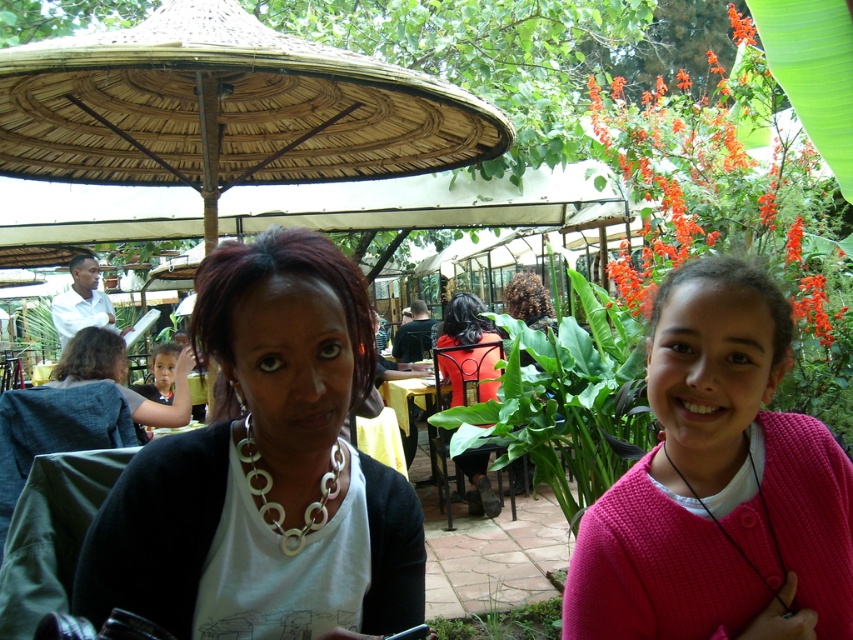
Does pink knitted sweater at center have a larger size compared to yellow fabric table at center?

No, pink knitted sweater at center is not bigger than yellow fabric table at center.

Is pink knitted sweater at center shorter than yellow fabric table at center?

Yes, pink knitted sweater at center is shorter than yellow fabric table at center.

Looking at this image, who is more distant from viewer, (x=625, y=502) or (x=384, y=403)?

The point (x=384, y=403) is behind.

In order to click on pink knitted sweater at center in this screenshot , I will do `click(718, 484)`.

Which is behind, point (485, 512) or point (403, 388)?

The point (403, 388) is more distant.

Measure the distance between orange fabric chair at center and camera.

The distance of orange fabric chair at center from camera is 4.81 meters.

Does point (486, 340) come closer to viewer compared to point (409, 365)?

Yes.

This screenshot has height=640, width=853. What are the coordinates of `orange fabric chair at center` in the screenshot? It's located at (468, 349).

Who is taller, matte white necklace at center or silver metallic necklace at center?

matte white necklace at center

Is point (361, 368) positioned after point (311, 500)?

That is False.

Identify the location of matte white necklace at center. (288, 349).

You are a GUI agent. You are given a task and a screenshot of the screen. Output one action in this format:
    pyautogui.click(x=<x>, y=<y>)
    Task: Click on the matte white necklace at center
    This screenshot has height=640, width=853.
    Given the screenshot: What is the action you would take?
    pyautogui.click(x=288, y=349)